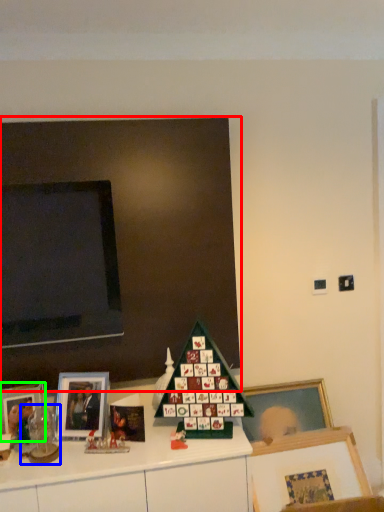
Question: Based on their relative distances, which object is nearer to bulletin board (highlighted by a red box)? Choose from toy (highlighted by a blue box) and picture frame (highlighted by a green box).

Choices:
 (A) toy
 (B) picture frame

Answer: (B)